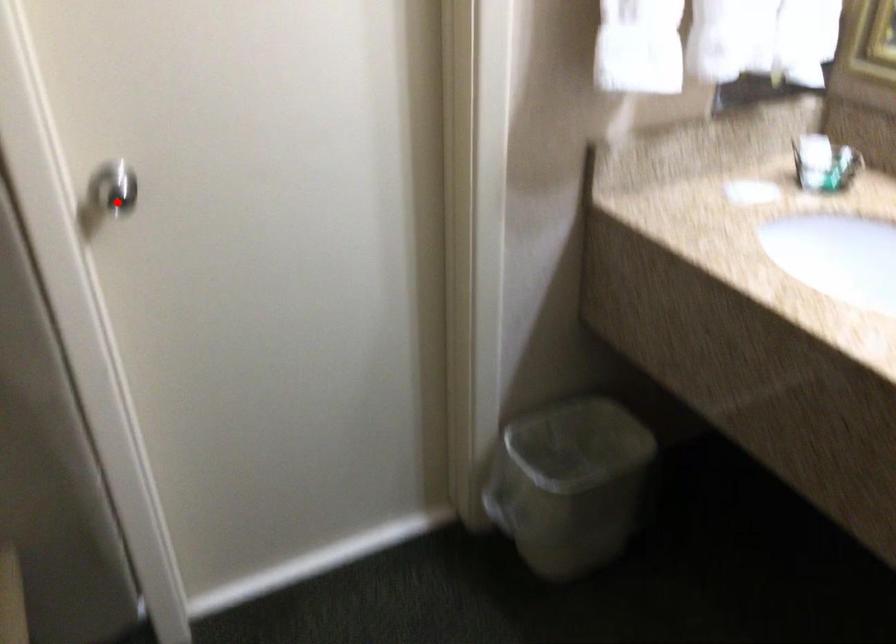
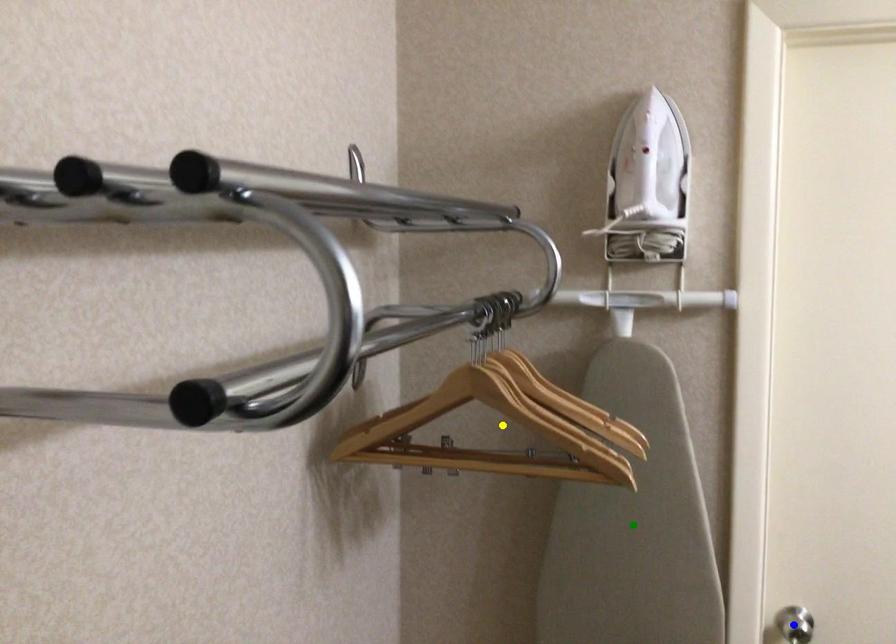
Question: I am providing you with two images of the same scene from different viewpoints. A red point is marked on the first image. You are given multiple points on the second image. Which point in image 2 is actually the same real-world point as the red point in image 1?

Choices:
 (A) blue point
 (B) yellow point
 (C) green point

Answer: (A)